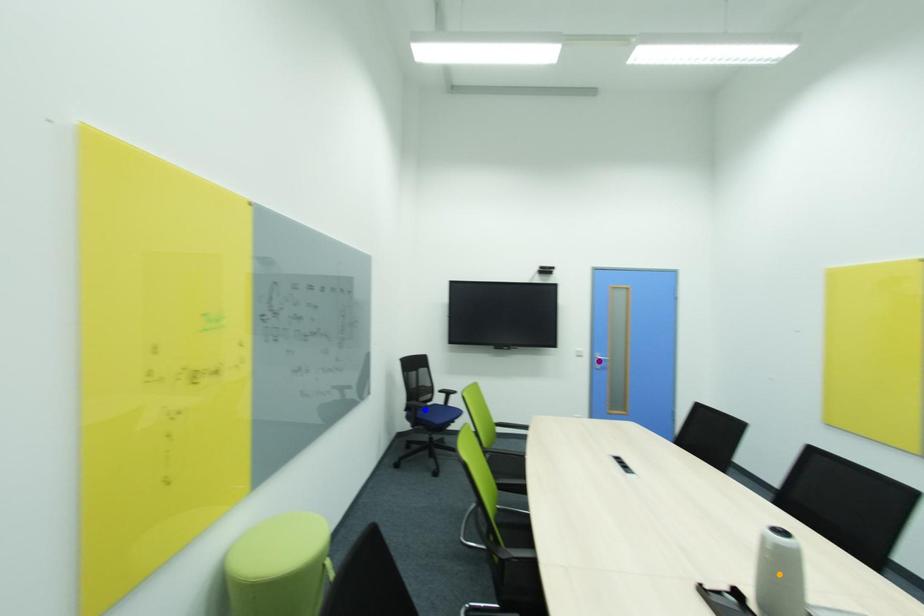
Order these from nearest to farthest:
1. orange point
2. blue point
3. purple point

purple point → blue point → orange point